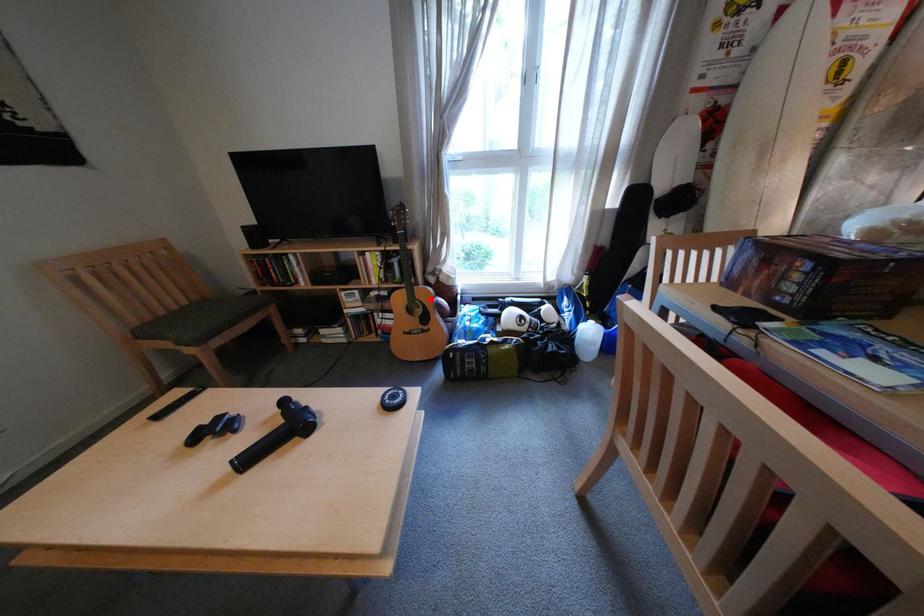
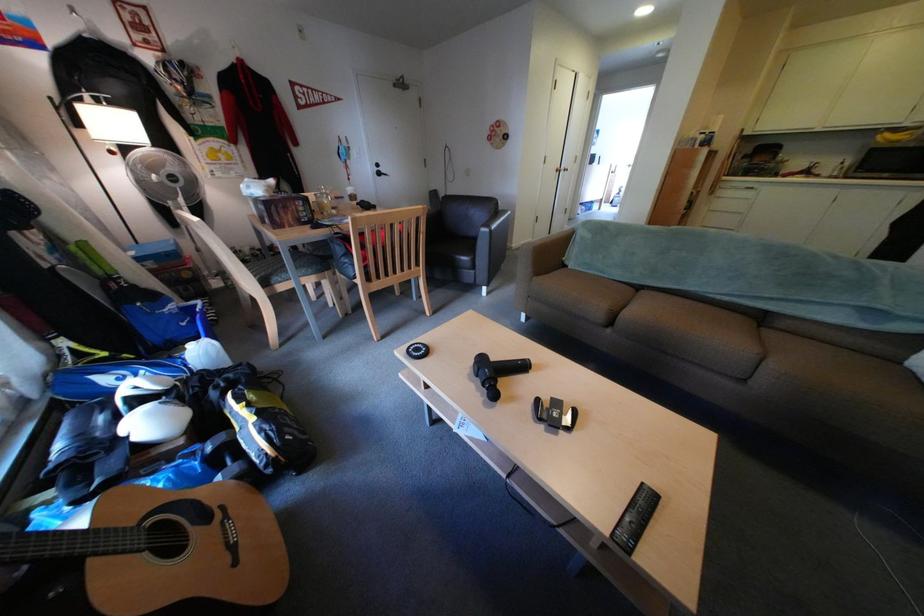
Question: A red point is marked in image1. In image2, is the corresponding 3D point closer to the camera or farther? Reply with the corresponding letter.

Choices:
 (A) The corresponding 3D point is closer.
 (B) The corresponding 3D point is farther.

Answer: (B)